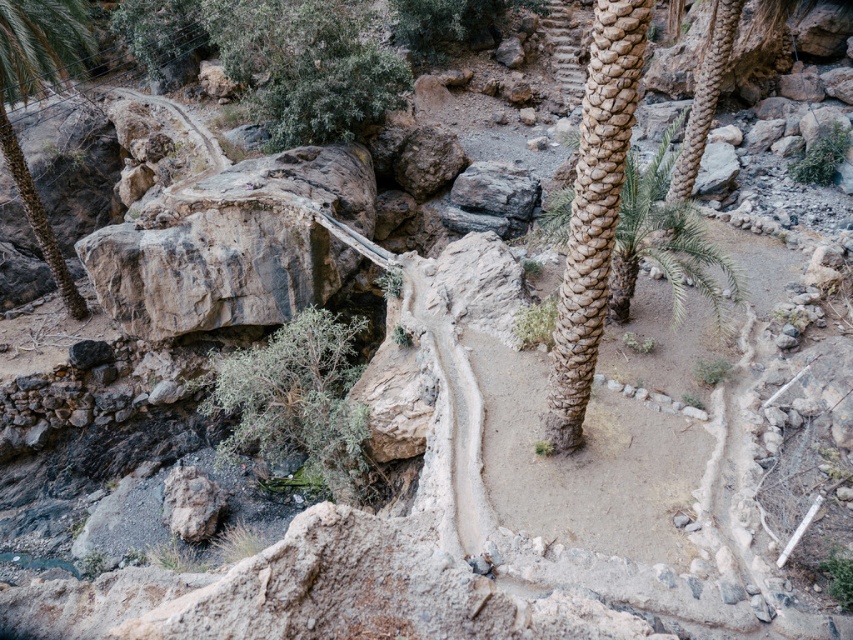
Question: Which point is farther to the camera?

Choices:
 (A) green leafy bush at center
 (B) green leafy tree at upper center

Answer: (B)

Question: Can you confirm if green leafy tree at upper center is positioned to the left of coarse textured palm tree at center?

Choices:
 (A) no
 (B) yes

Answer: (B)

Question: Which object is closer to the camera taking this photo?

Choices:
 (A) green leafy palm at left
 (B) green leafy bush at upper right

Answer: (A)

Question: Is green leafy tree at upper center bigger than coarse textured palm tree at center?

Choices:
 (A) yes
 (B) no

Answer: (B)

Question: Which point is closer to the camera?

Choices:
 (A) brown textured palm trunk at center
 (B) green leafy tree at upper center

Answer: (A)

Question: Does brown textured palm trunk at center have a smaller size compared to green leafy bush at upper right?

Choices:
 (A) no
 (B) yes

Answer: (B)